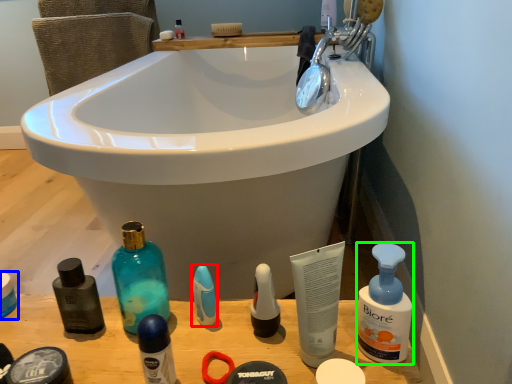
Question: Based on their relative distances, which object is nearer to toiletry (highlighted by a red box)? Choose from personal care (highlighted by a blue box) and cleaning product (highlighted by a green box).

Choices:
 (A) personal care
 (B) cleaning product

Answer: (B)